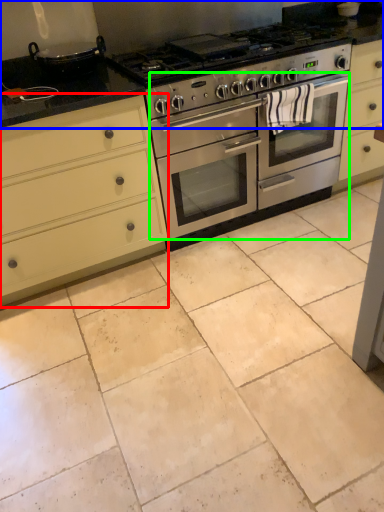
Question: Based on their relative distances, which object is farther from cabinetry (highlighted by a red box)? Choose from countertop (highlighted by a blue box) and oven (highlighted by a green box).

Choices:
 (A) countertop
 (B) oven

Answer: (A)